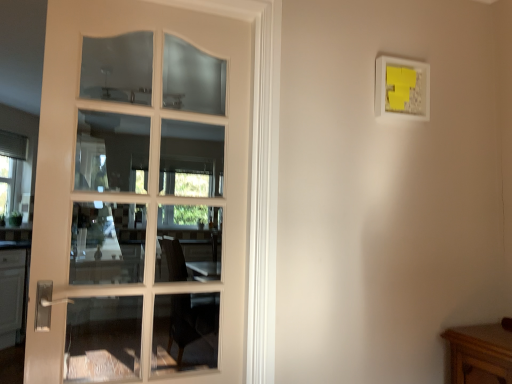
Question: Is white matte picture frame at upper right oriented away from white glossy door at left?

Choices:
 (A) no
 (B) yes

Answer: (A)

Question: Considering the relative sizes of white matte picture frame at upper right and white glossy door at left in the image provided, is white matte picture frame at upper right taller than white glossy door at left?

Choices:
 (A) no
 (B) yes

Answer: (A)

Question: From the image's perspective, does white matte picture frame at upper right appear higher than white glossy door at left?

Choices:
 (A) yes
 (B) no

Answer: (A)

Question: Is white matte picture frame at upper right outside white glossy door at left?

Choices:
 (A) yes
 (B) no

Answer: (A)

Question: Is white glossy door at left located within white matte picture frame at upper right?

Choices:
 (A) no
 (B) yes

Answer: (A)

Question: Does white matte picture frame at upper right lie in front of white glossy door at left?

Choices:
 (A) no
 (B) yes

Answer: (A)

Question: From the image's perspective, is wooden table at lower right under white matte picture frame at upper right?

Choices:
 (A) no
 (B) yes

Answer: (B)

Question: Is wooden table at lower right turned away from white matte picture frame at upper right?

Choices:
 (A) yes
 (B) no

Answer: (B)

Question: Is wooden table at lower right oriented towards white matte picture frame at upper right?

Choices:
 (A) yes
 (B) no

Answer: (B)

Question: From a real-world perspective, is wooden table at lower right below white matte picture frame at upper right?

Choices:
 (A) yes
 (B) no

Answer: (A)

Question: Is wooden table at lower right to the left of white matte picture frame at upper right from the viewer's perspective?

Choices:
 (A) yes
 (B) no

Answer: (B)

Question: Is wooden table at lower right in front of white matte picture frame at upper right?

Choices:
 (A) yes
 (B) no

Answer: (A)

Question: Is wooden table at lower right far away from white glossy door at left?

Choices:
 (A) no
 (B) yes

Answer: (B)